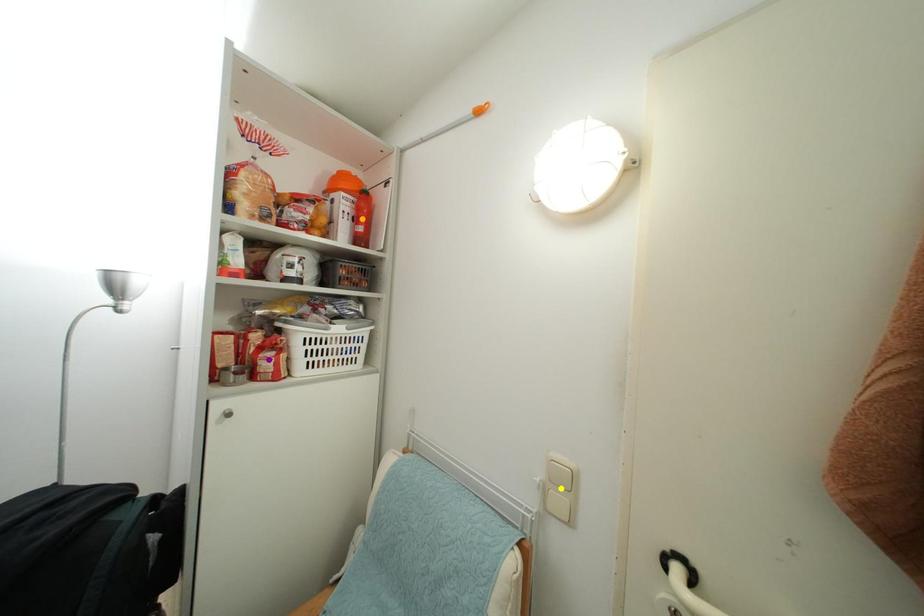
Order these from nearest to farthest:
- purple point
- yellow point
- orange point

yellow point
purple point
orange point